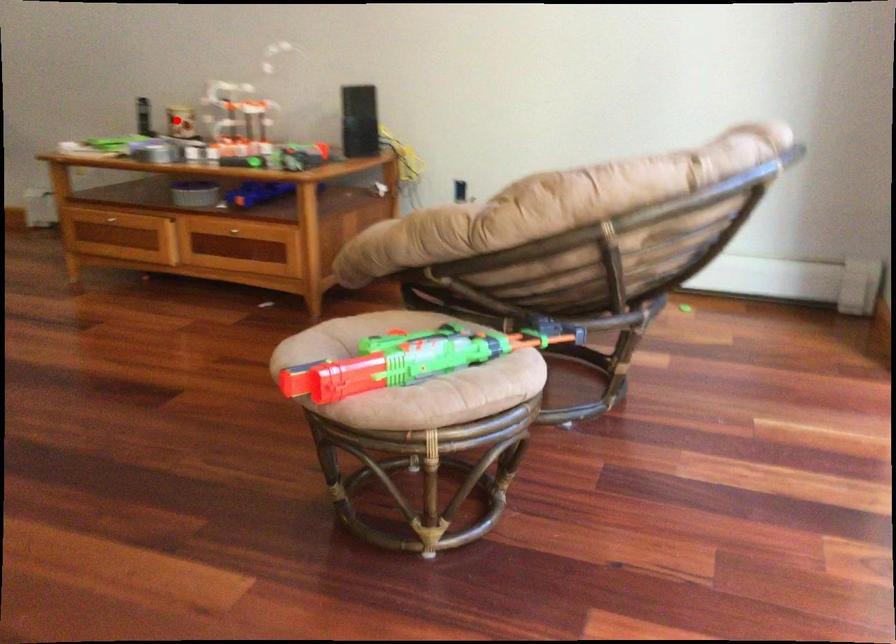
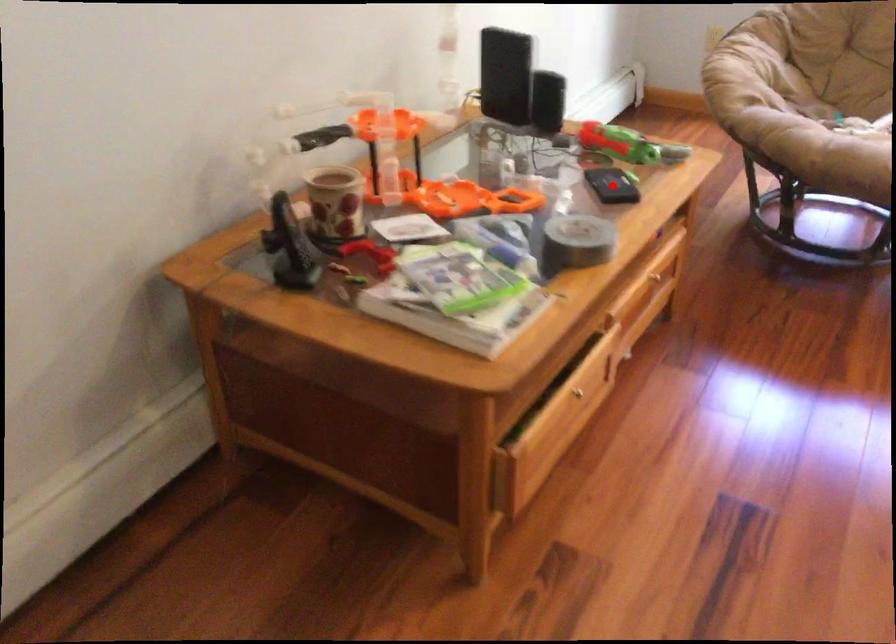
I am providing you with two images of the same scene from different viewpoints. A red point is marked on the first image and another point is marked on the second image. Does the point marked in image1 correspond to the same location as the one in image2?

No